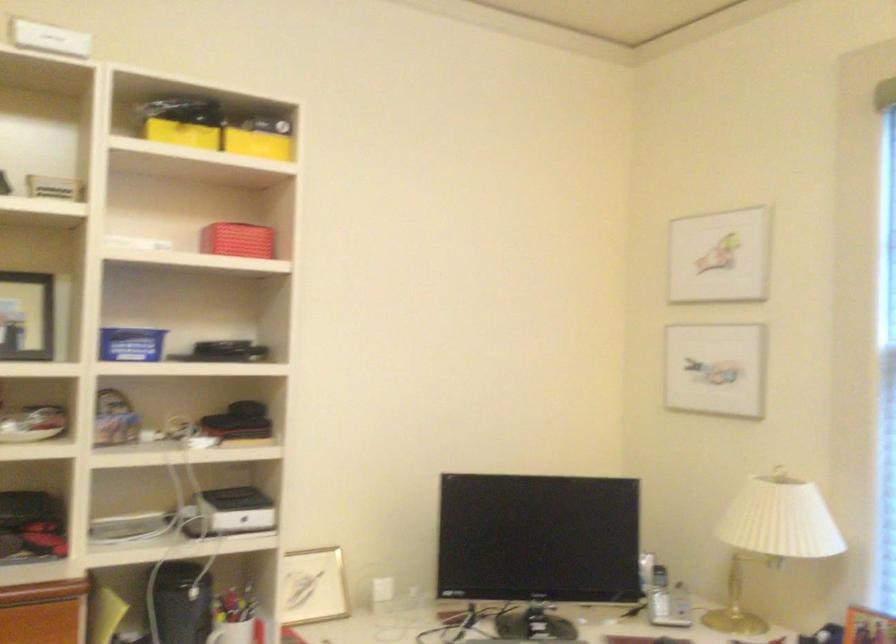
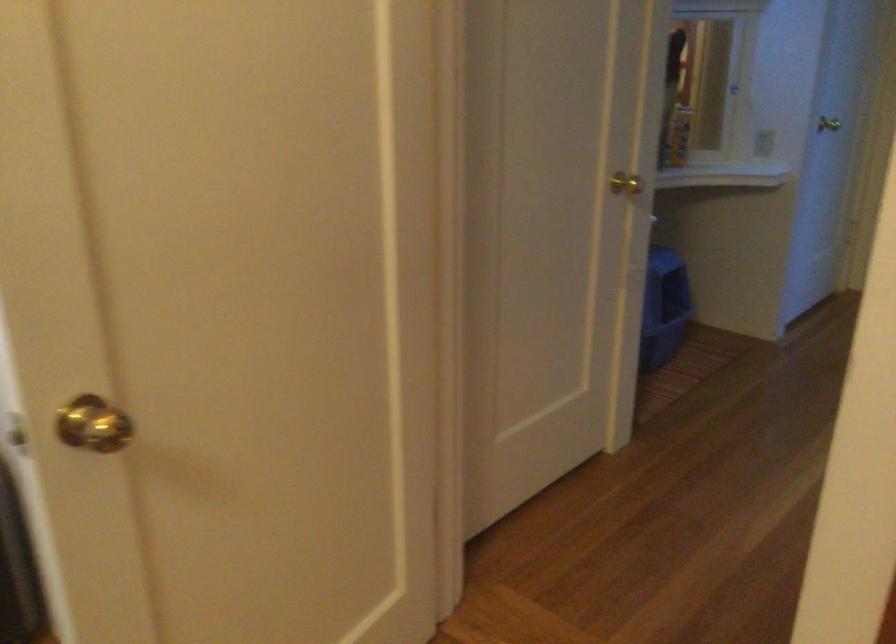
The images are taken continuously from a first-person perspective. In which direction is your viewpoint rotating?

The rotation direction of the camera is right-down.